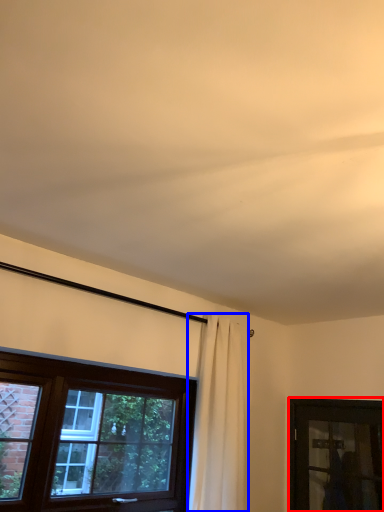
Question: Which point is further to the camera, window (highlighted by a red box) or curtain (highlighted by a blue box)?

Choices:
 (A) window
 (B) curtain

Answer: (A)